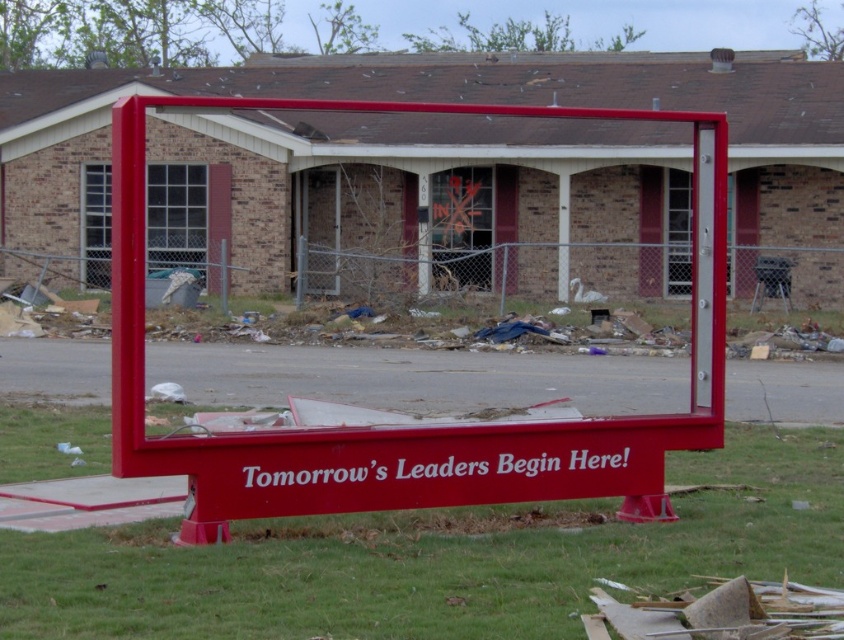
Question: Does green grass at lower center have a smaller size compared to red matte sign at center?

Choices:
 (A) no
 (B) yes

Answer: (B)

Question: Which point appears farthest from the camera in this image?

Choices:
 (A) (707, 504)
 (B) (134, 346)

Answer: (A)

Question: Does green grass at lower center have a smaller size compared to red matte sign at center?

Choices:
 (A) no
 (B) yes

Answer: (B)

Question: Which of the following is the closest to the observer?

Choices:
 (A) (388, 545)
 (B) (365, 432)

Answer: (A)

Question: Is green grass at lower center to the right of red matte sign at center from the viewer's perspective?

Choices:
 (A) yes
 (B) no

Answer: (B)